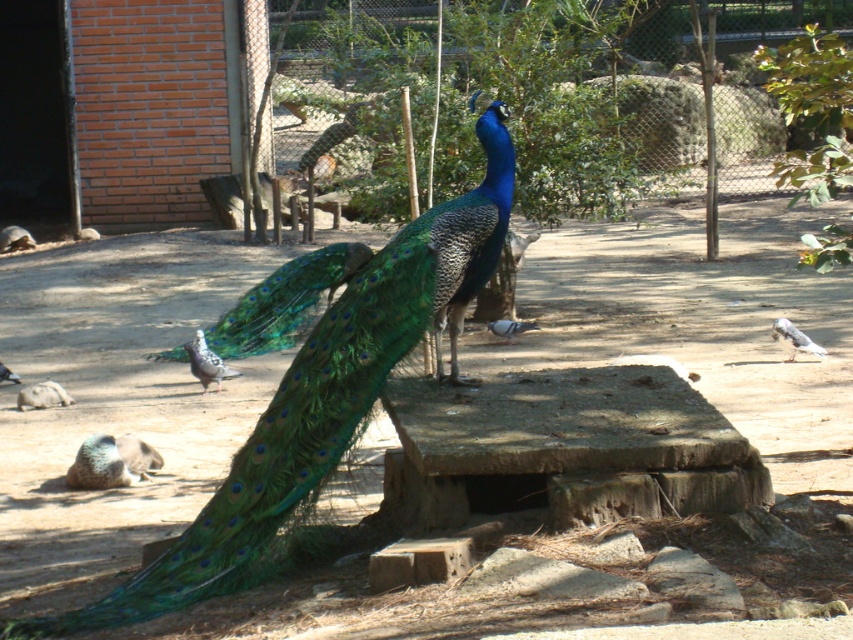
Can you confirm if green iridescent peacock at lower left is positioned to the right of matte gray pigeon at lower left?

Yes, green iridescent peacock at lower left is to the right of matte gray pigeon at lower left.

Is point (108, 451) positioned in front of point (16, 381)?

Yes, it is in front of point (16, 381).

Does point (125, 465) come closer to viewer compared to point (10, 371)?

Yes.

At what (x,y) coordinates should I click in order to perform the action: click on green iridescent peacock at lower left. Please return your answer as a coordinate pair (x, y). This screenshot has width=853, height=640. Looking at the image, I should click on (111, 461).

Does shiny blue peacock at center have a greater width compared to gray matte pigeon at center?

Correct, the width of shiny blue peacock at center exceeds that of gray matte pigeon at center.

Between point (486, 120) and point (503, 321), which one is positioned in front?

Positioned in front is point (486, 120).

Which is behind, point (204, 532) or point (520, 326)?

Positioned behind is point (520, 326).

Where is `shiny blue peacock at center`? Image resolution: width=853 pixels, height=640 pixels. shiny blue peacock at center is located at coordinates (323, 396).

Does white feathered bird at right have a larger size compared to matte gray pigeon at lower left?

Correct, white feathered bird at right is larger in size than matte gray pigeon at lower left.

Between white feathered bird at right and matte gray pigeon at lower left, which one has more height?

white feathered bird at right

Between point (799, 348) and point (4, 372), which one is positioned in front?

Point (4, 372) is in front.

Where is `white feathered bird at right`? white feathered bird at right is located at coordinates (793, 339).